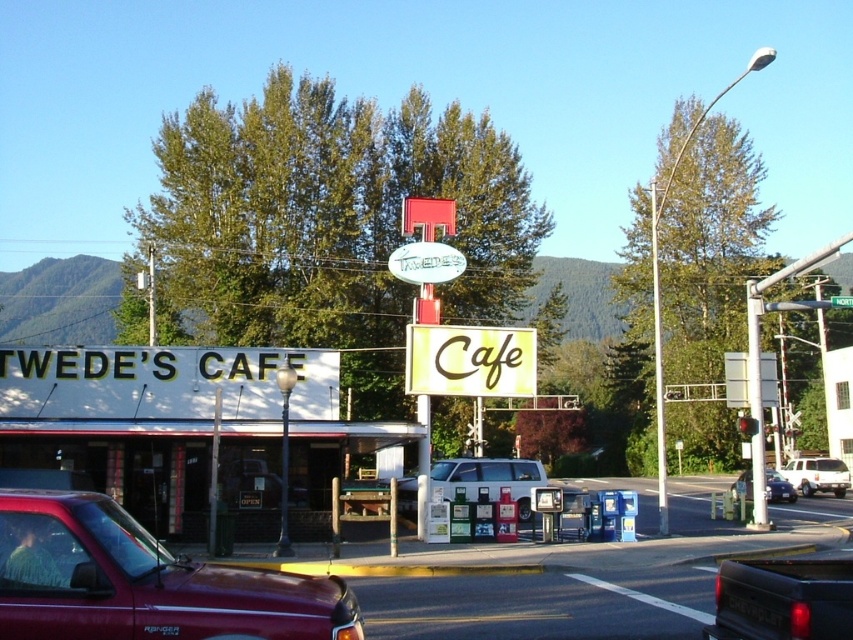
Question: Which point is closer to the camera?

Choices:
 (A) white matte suv at center
 (B) silver metallic sedan at center

Answer: (A)

Question: Which object is the farthest from the white matte suv at center?

Choices:
 (A) white matte van at center
 (B) matte black truck at lower right

Answer: (B)

Question: Is yellow matte cafe at center bigger than white matte van at center?

Choices:
 (A) no
 (B) yes

Answer: (A)

Question: Is matte black truck at lower right to the left of white matte van at center from the viewer's perspective?

Choices:
 (A) yes
 (B) no

Answer: (A)

Question: Can you confirm if white matte signboard at center is wider than yellow matte cafe at center?

Choices:
 (A) no
 (B) yes

Answer: (A)

Question: Which object is positioned farthest from the white matte signboard at center?

Choices:
 (A) metallic red truck at lower left
 (B) white matte suv at center

Answer: (A)